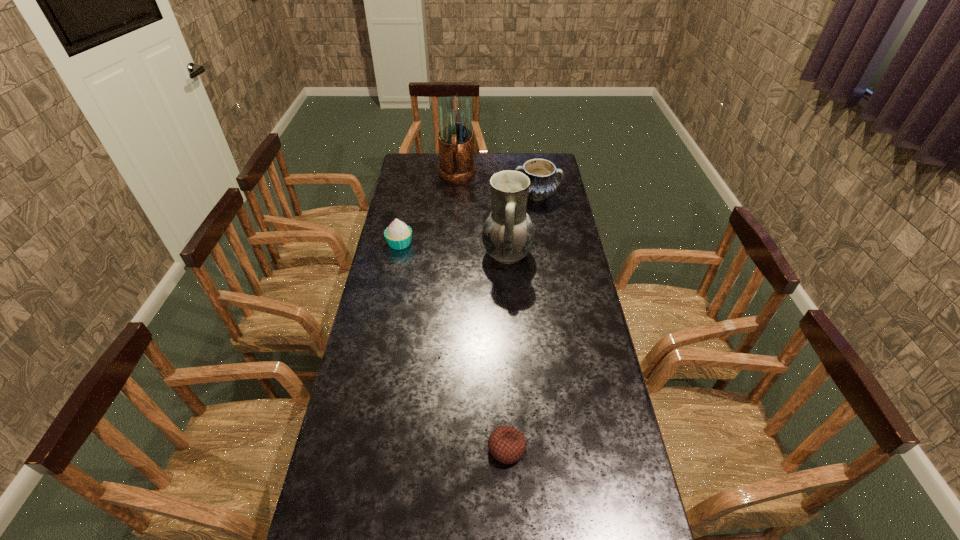
Locate an element on the screen. Image resolution: width=960 pixels, height=540 pixels. blank area at the right edge is located at coordinates (558, 234).

Where is `vacant area at the far left corner of the desktop`? Image resolution: width=960 pixels, height=540 pixels. vacant area at the far left corner of the desktop is located at coordinates (422, 160).

You are a GUI agent. You are given a task and a screenshot of the screen. Output one action in this format:
    pyautogui.click(x=<x>, y=<y>)
    Task: Click on the empty space that is in between the shortest object and the pottery
    The image size is (960, 540).
    Given the screenshot: What is the action you would take?
    pyautogui.click(x=521, y=322)

At what (x,y) coordinates should I click in order to perform the action: click on free spot between the shortest object and the nearer pitcher. Please return your answer as a coordinate pair (x, y). Image resolution: width=960 pixels, height=540 pixels. Looking at the image, I should click on (507, 351).

At what (x,y) coordinates should I click in order to perform the action: click on free point between the leftmost object and the third shortest object. Please return your answer as a coordinate pair (x, y). The height and width of the screenshot is (540, 960). Looking at the image, I should click on (468, 220).

You are a GUI agent. You are given a task and a screenshot of the screen. Output one action in this format:
    pyautogui.click(x=<x>, y=<y>)
    Task: Click on the free point between the nearest object and the pottery
    This screenshot has width=960, height=540.
    Given the screenshot: What is the action you would take?
    pyautogui.click(x=521, y=322)

Identify the location of empty space between the right pitcher and the beanbag. (507, 351).

Locate an element on the screen. This screenshot has height=540, width=960. vacant space that is in between the farther pitcher and the beanbag is located at coordinates (482, 312).

The width and height of the screenshot is (960, 540). In order to click on empty space between the left pitcher and the leftmost object in this screenshot , I will do `click(428, 209)`.

Where is `vacant space in between the right pitcher and the left pitcher`? This screenshot has width=960, height=540. vacant space in between the right pitcher and the left pitcher is located at coordinates (482, 214).